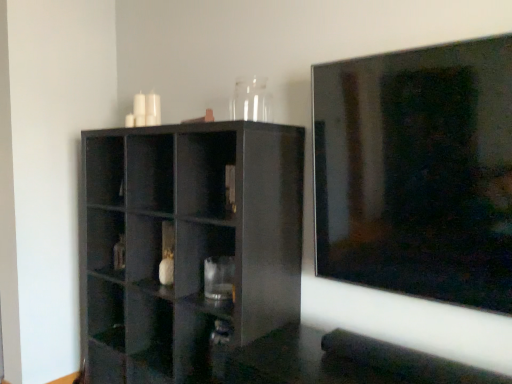
Question: Is transparent glass vase at upper center a part of glossy black shelf at center?

Choices:
 (A) yes
 (B) no

Answer: (B)

Question: Does glossy black shelf at center have a greater height compared to transparent glass vase at upper center?

Choices:
 (A) no
 (B) yes

Answer: (B)

Question: Is glossy black shelf at center positioned with its back to transparent glass vase at upper center?

Choices:
 (A) yes
 (B) no

Answer: (B)

Question: Can you confirm if glossy black shelf at center is bigger than transparent glass vase at upper center?

Choices:
 (A) yes
 (B) no

Answer: (A)

Question: Does glossy black shelf at center lie in front of transparent glass vase at upper center?

Choices:
 (A) no
 (B) yes

Answer: (B)

Question: Is glossy black shelf at center at the left side of transparent glass vase at upper center?

Choices:
 (A) no
 (B) yes

Answer: (B)

Question: From a real-world perspective, is transparent glass vase at upper center on glossy black shelf at center?

Choices:
 (A) no
 (B) yes

Answer: (B)

Question: Can you confirm if transparent glass vase at upper center is taller than glossy black shelf at center?

Choices:
 (A) yes
 (B) no

Answer: (B)

Question: Is transparent glass vase at upper center looking in the opposite direction of glossy black shelf at center?

Choices:
 (A) yes
 (B) no

Answer: (B)

Question: Is transparent glass vase at upper center smaller than glossy black shelf at center?

Choices:
 (A) no
 (B) yes

Answer: (B)

Question: Considering the relative sizes of transparent glass vase at upper center and glossy black shelf at center in the image provided, is transparent glass vase at upper center wider than glossy black shelf at center?

Choices:
 (A) no
 (B) yes

Answer: (A)

Question: Is transparent glass vase at upper center outside glossy black shelf at center?

Choices:
 (A) no
 (B) yes

Answer: (B)

Question: From the image's perspective, is glossy black shelf at center positioned above or below transparent glass vase at upper center?

Choices:
 (A) above
 (B) below

Answer: (B)